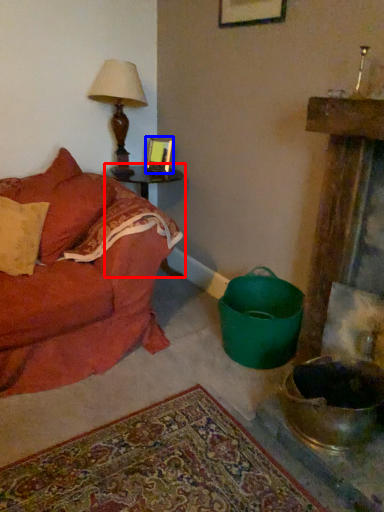
Question: Which point is further to the camera, table (highlighted by a red box) or picture frame (highlighted by a blue box)?

Choices:
 (A) table
 (B) picture frame

Answer: (B)